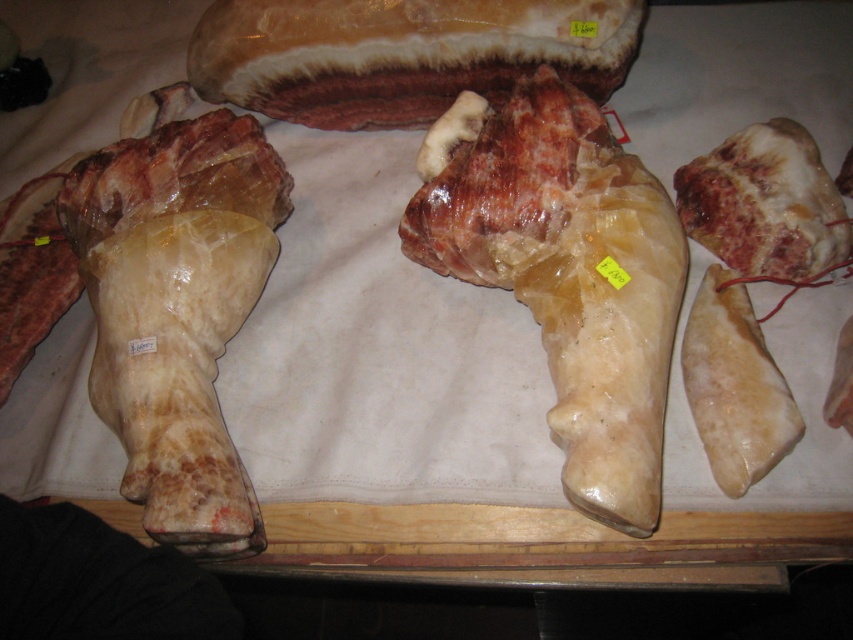
You are a customer at a butcher shop and want to buy the meat located at point (96, 392) and point (844, 257). The shop has a rule that you can only pick up items from the front first. Which point should you pick first?

You should pick up the meat at point (96, 392) first because it is in front of point (844, 257) according to the shop rule.

You are a customer at a butcher shop and want to point out two specific points on the meat display. The first point you want to indicate is point (x=548, y=241) and the second is point (x=201, y=154). When you look at these points from your position at the front of the table, which point is closer to you?

Point (x=548, y=241) is in front of point (x=201, y=154), so it is closer to you.